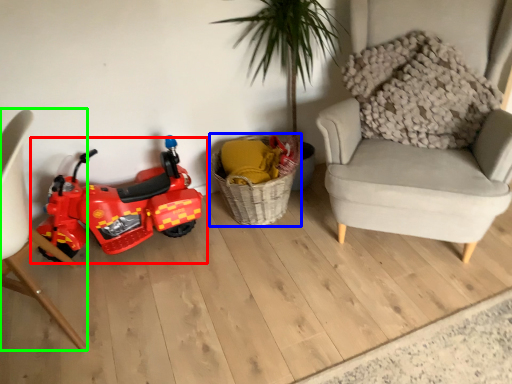
Question: Which object is positioned closest to land vehicle (highlighted by a red box)? Select from basket (highlighted by a blue box) and chair (highlighted by a green box).

Choices:
 (A) basket
 (B) chair

Answer: (B)